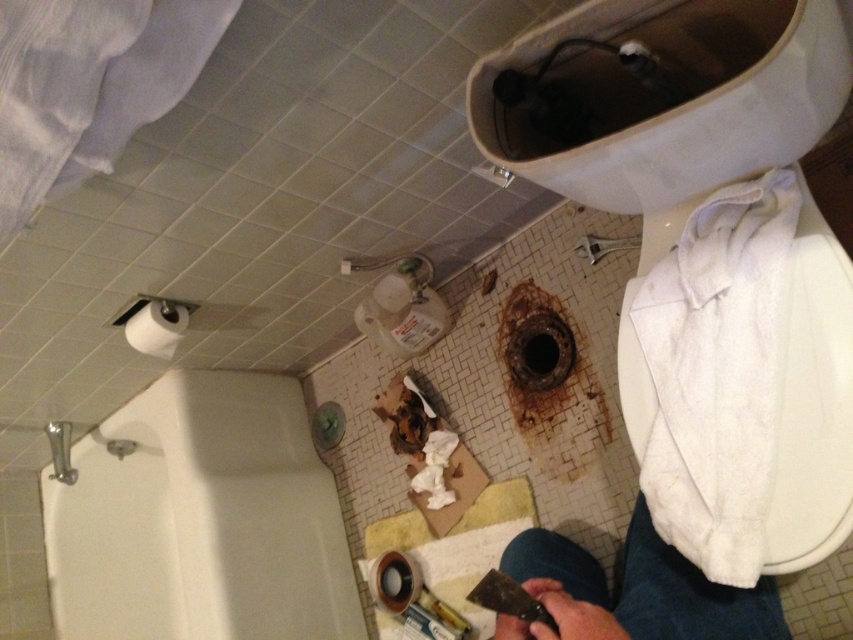
You are a repair worker in the bathroom. You need to place a 12 inch tool on the floor between the jeans at lower right and the camera. Is there enough space?

The jeans at lower right and the camera are 24.73 inches apart from each other, so yes, there is enough space to place a 12 inch tool between them.

You are a repair worker standing at point A, which is at the location of point (167, 348). You need to reach point B, located at point (718, 195). According to the scene, which direction should you move to get there?

To reach point B at (718, 195) from point A at (167, 348), you should move forward since point B is in front of point A.

You are standing in the bathroom and want to avoid the hole in the floor. The point marked as point [149,627] is 1.63 meters away from you. Is the hole closer to you than that point?

The hole is closer to you than point [149,627] because the point is 1.63 meters away from you, but the hole is in the center of the floor, which is likely closer than that distance.